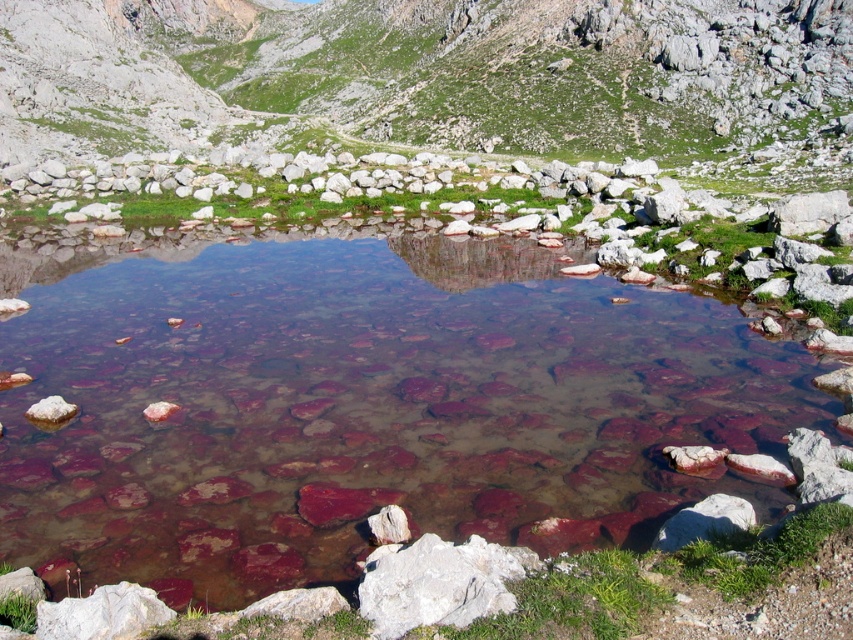
Which is below, white smooth rock at lower right or reddish-brown rock at lower left?

white smooth rock at lower right

Between point (717, 512) and point (70, 403), which one is positioned behind?

Point (70, 403)

Find the location of a particular element. This screenshot has height=640, width=853. white smooth rock at lower right is located at coordinates (704, 520).

This screenshot has height=640, width=853. In order to click on white smooth rock at lower right in this screenshot , I will do `click(704, 520)`.

What do you see at coordinates (438, 582) in the screenshot?
I see `white rough rock at center` at bounding box center [438, 582].

Which is more to the left, white rough rock at center or reddish-brown rock at lower left?

From the viewer's perspective, reddish-brown rock at lower left appears more on the left side.

You are a GUI agent. You are given a task and a screenshot of the screen. Output one action in this format:
    pyautogui.click(x=<x>, y=<y>)
    Task: Click on the white rough rock at center
    
    Given the screenshot: What is the action you would take?
    pyautogui.click(x=438, y=582)

Is white rough rock at center to the right of white smooth rock at lower right from the viewer's perspective?

No, white rough rock at center is not to the right of white smooth rock at lower right.

Is point (436, 586) positioned before point (686, 538)?

Yes, point (436, 586) is closer to viewer.

Is point (434, 616) less distant than point (709, 513)?

Yes, point (434, 616) is in front of point (709, 513).

Find the location of a particular element. The width and height of the screenshot is (853, 640). white rough rock at center is located at coordinates (438, 582).